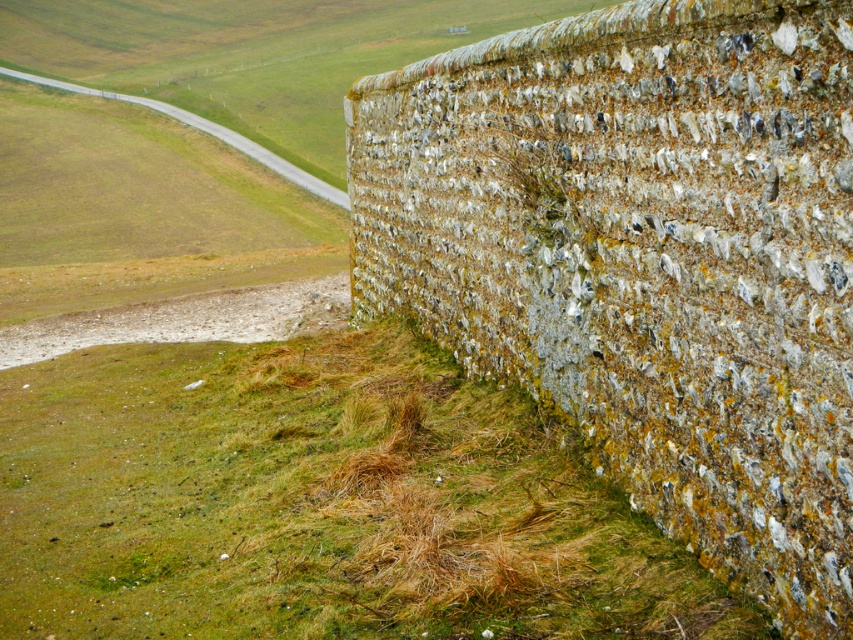
Question: Can you confirm if speckled stone wall at right is thinner than green mossy grass at lower left?

Choices:
 (A) yes
 (B) no

Answer: (A)

Question: Which object is closer to the camera taking this photo?

Choices:
 (A) speckled stone wall at right
 (B) green mossy grass at lower left

Answer: (A)

Question: Which object appears farthest from the camera in this image?

Choices:
 (A) green mossy grass at lower left
 (B) speckled stone wall at right

Answer: (A)

Question: Is speckled stone wall at right thinner than green mossy grass at lower left?

Choices:
 (A) no
 (B) yes

Answer: (B)

Question: Is speckled stone wall at right further to camera compared to green mossy grass at lower left?

Choices:
 (A) yes
 (B) no

Answer: (B)